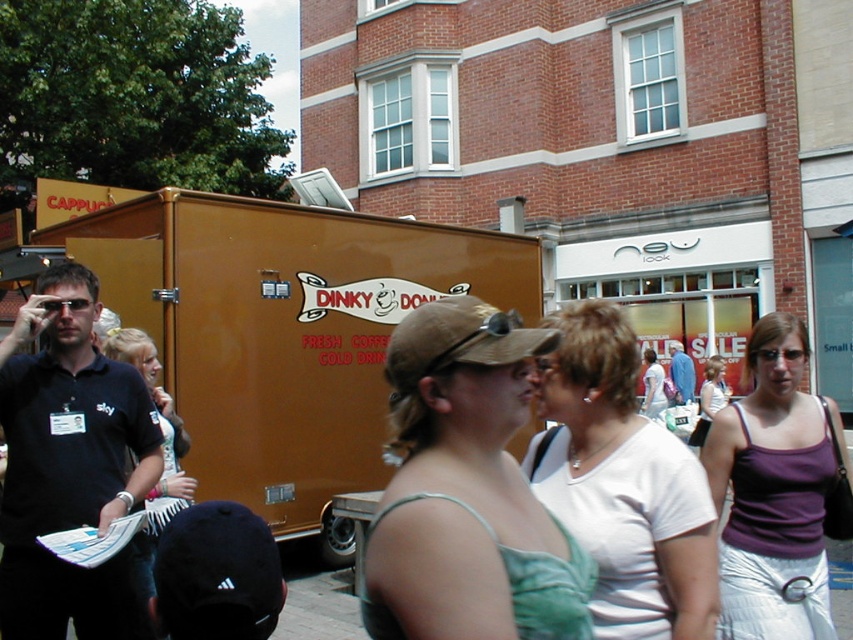
Question: Can you confirm if green fabric tank top at center is positioned to the right of white cotton shirt at center?

Choices:
 (A) yes
 (B) no

Answer: (B)

Question: Which object appears closest to the camera in this image?

Choices:
 (A) white cotton shirt at center
 (B) purple fabric tank top at center-right
 (C) white fabric scarf at center

Answer: (A)

Question: Can you confirm if white cotton shirt at center is positioned to the left of white fabric scarf at center?

Choices:
 (A) no
 (B) yes

Answer: (A)

Question: Which point is farther from the camera taking this photo?

Choices:
 (A) (769, 328)
 (B) (172, 426)
 (C) (715, 566)
 (D) (383, 595)

Answer: (B)

Question: Does green fabric tank top at center appear over white cotton shirt at center?

Choices:
 (A) no
 (B) yes

Answer: (B)

Question: Which point is closer to the camera?

Choices:
 (A) [x=207, y=400]
 (B) [x=643, y=637]
 (C) [x=579, y=547]
 (D) [x=802, y=605]

Answer: (C)